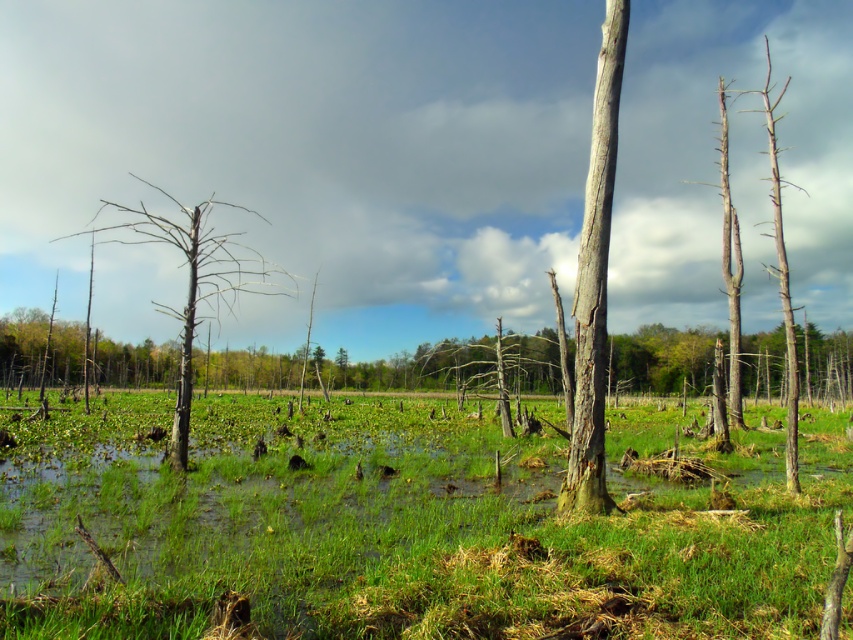
Question: Is green grassy at center to the right of smooth gray bark tree at center from the viewer's perspective?

Choices:
 (A) no
 (B) yes

Answer: (B)

Question: Can you confirm if smooth gray bark tree at center is wider than gray bark tree at left?

Choices:
 (A) no
 (B) yes

Answer: (A)

Question: Among these objects, which one is nearest to the camera?

Choices:
 (A) green grassy at center
 (B) gray bark tree at left

Answer: (A)

Question: Which point appears farthest from the camera in this image?

Choices:
 (A) (154, 227)
 (B) (438, 444)
 (C) (622, 13)

Answer: (B)

Question: Which object is farther from the camera taking this photo?

Choices:
 (A) smooth gray bark tree at center
 (B) gray bark tree at left

Answer: (B)

Question: Is smooth gray bark tree at center positioned at the back of gray bark tree at left?

Choices:
 (A) no
 (B) yes

Answer: (A)